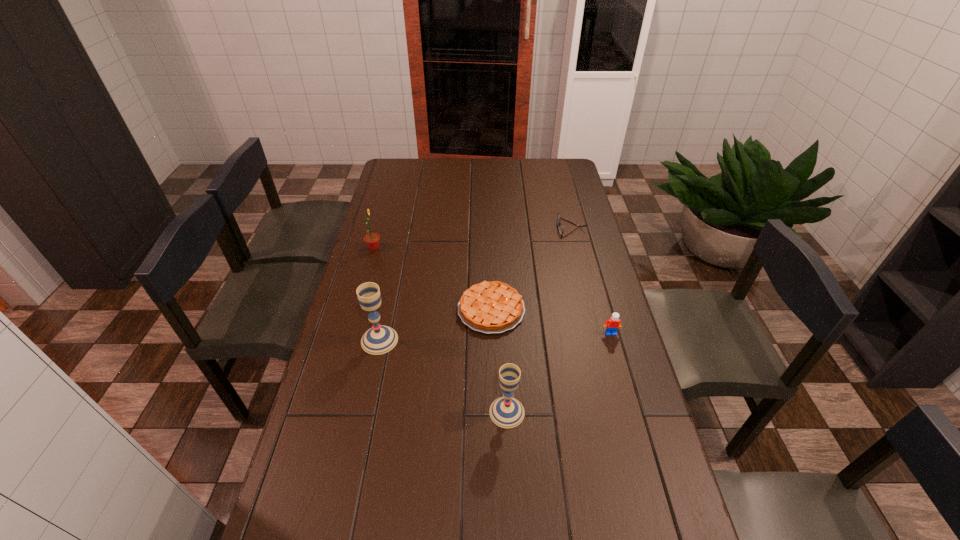
Identify the location of free space that satisfies the following two spatial constraints: 1. on the back side of the pie; 2. on the face of the second farthest object. This screenshot has width=960, height=540. (490, 248).

Where is `free space that satisfies the following two spatial constraints: 1. on the face of the second farthest object; 2. on the back side of the pie`? The width and height of the screenshot is (960, 540). free space that satisfies the following two spatial constraints: 1. on the face of the second farthest object; 2. on the back side of the pie is located at coordinates (357, 309).

Image resolution: width=960 pixels, height=540 pixels. Identify the location of free spot that satisfies the following two spatial constraints: 1. on the face of the nearer chalice; 2. on the right side of the leftmost object. (328, 412).

The height and width of the screenshot is (540, 960). In order to click on vacant space that satisfies the following two spatial constraints: 1. on the face of the sunflower; 2. on the right side of the left chalice in this screenshot , I will do `click(348, 340)`.